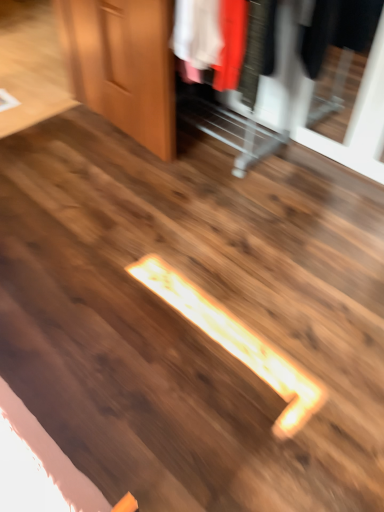
You are a GUI agent. You are given a task and a screenshot of the screen. Output one action in this format:
    pyautogui.click(x=<x>, y=<y>)
    Task: Click on the blank space to the left of wooden dresser at upper right
    
    Given the screenshot: What is the action you would take?
    pyautogui.click(x=70, y=155)